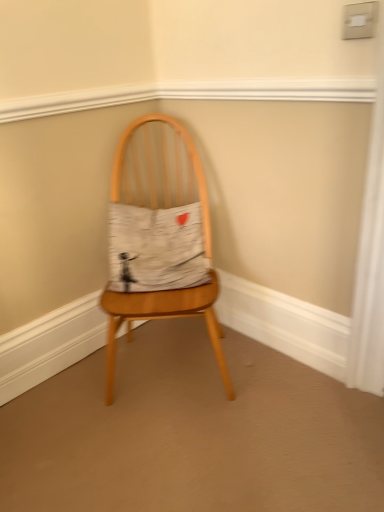
Question: From a real-world perspective, is wooden chair at center above or below white cotton cushion at center?

Choices:
 (A) below
 (B) above

Answer: (A)

Question: Is wooden chair at center wider or thinner than white cotton cushion at center?

Choices:
 (A) wide
 (B) thin

Answer: (A)

Question: From the image's perspective, relative to white cotton cushion at center, is wooden chair at center above or below?

Choices:
 (A) above
 (B) below

Answer: (B)

Question: Considering the positions of white cotton cushion at center and wooden chair at center in the image, is white cotton cushion at center taller or shorter than wooden chair at center?

Choices:
 (A) tall
 (B) short

Answer: (B)

Question: Based on their sizes in the image, would you say white cotton cushion at center is bigger or smaller than wooden chair at center?

Choices:
 (A) small
 (B) big

Answer: (A)

Question: From a real-world perspective, is white cotton cushion at center above or below wooden chair at center?

Choices:
 (A) above
 (B) below

Answer: (A)

Question: From the image's perspective, is white cotton cushion at center above or below wooden chair at center?

Choices:
 (A) below
 (B) above

Answer: (B)